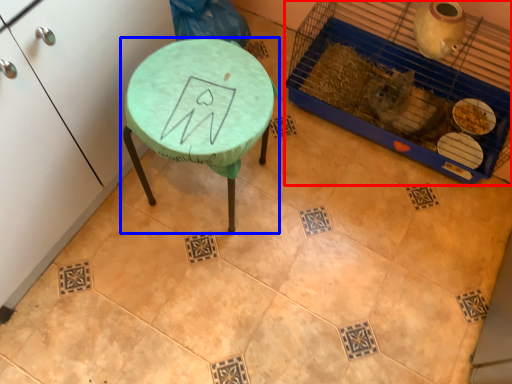
Question: Which of the following is the closest to the observer, bird cage (highlighted by a red box) or table (highlighted by a blue box)?

Choices:
 (A) bird cage
 (B) table

Answer: (B)